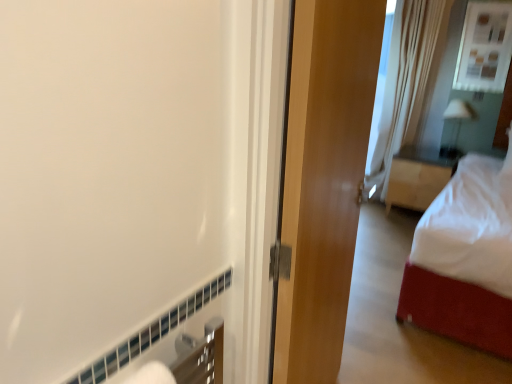
Question: From the image's perspective, is glossy wood door at center above or below wooden nightstand at right?

Choices:
 (A) above
 (B) below

Answer: (B)

Question: In the image, is glossy wood door at center on the left side or the right side of wooden nightstand at right?

Choices:
 (A) left
 (B) right

Answer: (A)

Question: Estimate the real-world distances between objects in this image. Which object is closer to the glossy wood door at center?

Choices:
 (A) white glossy lamp at upper right
 (B) matte glass window at upper right
 (C) wooden nightstand at right
 (D) white soft bed at right
 (E) white sheer curtain at right

Answer: (D)

Question: Which is farther from the wooden nightstand at right?

Choices:
 (A) matte glass window at upper right
 (B) glossy wood door at center
 (C) white soft bed at right
 (D) white sheer curtain at right
 (E) white glossy lamp at upper right

Answer: (B)